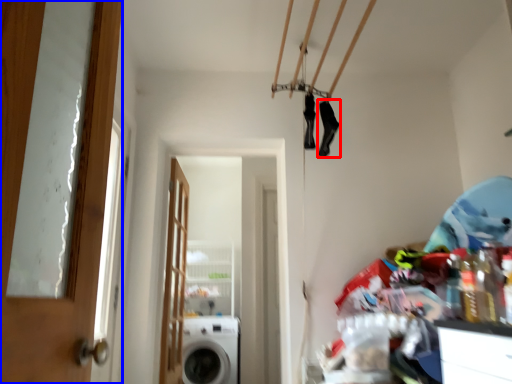
Question: Which of the following is the closest to the observer, shoe (highlighted by a red box) or door (highlighted by a blue box)?

Choices:
 (A) shoe
 (B) door

Answer: (B)